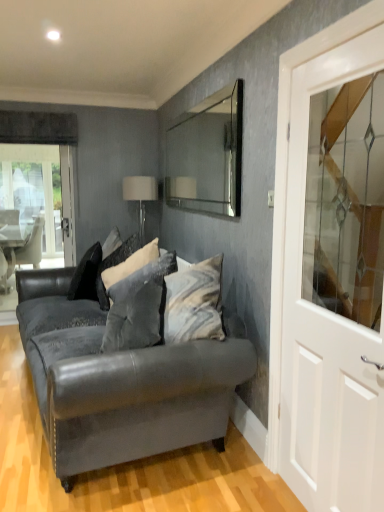
Question: Should I look upward or downward to see black velvet pillow at center, acting as the third pillow starting from the front?

Choices:
 (A) up
 (B) down

Answer: (B)

Question: Should I look upward or downward to see white glossy door at right?

Choices:
 (A) down
 (B) up

Answer: (A)

Question: From the image's perspective, is black velvet pillow at center, which is the 1th pillow in back-to-front order, located beneath velvet gray pillow at center, arranged as the first pillow when viewed from the front?

Choices:
 (A) yes
 (B) no

Answer: (B)

Question: Does black velvet pillow at center, acting as the third pillow starting from the front, have a smaller size compared to velvet gray pillow at center, arranged as the 3th pillow when viewed from the back?

Choices:
 (A) yes
 (B) no

Answer: (A)

Question: Considering the relative positions of black velvet pillow at center, which is the 1th pillow in back-to-front order, and velvet gray pillow at center, arranged as the 3th pillow when viewed from the back, in the image provided, is black velvet pillow at center, which is the 1th pillow in back-to-front order, behind velvet gray pillow at center, arranged as the 3th pillow when viewed from the back,?

Choices:
 (A) no
 (B) yes

Answer: (B)

Question: Are black velvet pillow at center, which is the 1th pillow in back-to-front order, and velvet gray pillow at center, arranged as the 3th pillow when viewed from the back, beside each other?

Choices:
 (A) no
 (B) yes

Answer: (A)

Question: Does black velvet pillow at center, which is the 1th pillow in back-to-front order, turn towards velvet gray pillow at center, arranged as the first pillow when viewed from the front?

Choices:
 (A) yes
 (B) no

Answer: (B)

Question: Considering the relative sizes of black velvet pillow at center, which is the 1th pillow in back-to-front order, and velvet gray pillow at center, arranged as the 3th pillow when viewed from the back, in the image provided, is black velvet pillow at center, which is the 1th pillow in back-to-front order, bigger than velvet gray pillow at center, arranged as the 3th pillow when viewed from the back,?

Choices:
 (A) yes
 (B) no

Answer: (B)

Question: From a real-world perspective, is clear glass mirror at upper center under velvet gray pillow at center, arranged as the 2th pillow when viewed from the front?

Choices:
 (A) no
 (B) yes

Answer: (A)

Question: Is clear glass mirror at upper center with velvet gray pillow at center, arranged as the 2th pillow when viewed from the front?

Choices:
 (A) yes
 (B) no

Answer: (B)

Question: Is clear glass mirror at upper center positioned beyond the bounds of velvet gray pillow at center, placed as the second pillow when sorted from back to front?

Choices:
 (A) yes
 (B) no

Answer: (A)

Question: Does clear glass mirror at upper center appear on the right side of velvet gray pillow at center, arranged as the 2th pillow when viewed from the front?

Choices:
 (A) no
 (B) yes

Answer: (B)

Question: Does clear glass mirror at upper center have a lesser height compared to velvet gray pillow at center, arranged as the 2th pillow when viewed from the front?

Choices:
 (A) no
 (B) yes

Answer: (A)

Question: Is clear glass mirror at upper center taller than velvet gray pillow at center, placed as the second pillow when sorted from back to front?

Choices:
 (A) no
 (B) yes

Answer: (B)

Question: Is white fabric lampshade at upper center further to camera compared to clear glass mirror at upper center?

Choices:
 (A) yes
 (B) no

Answer: (A)